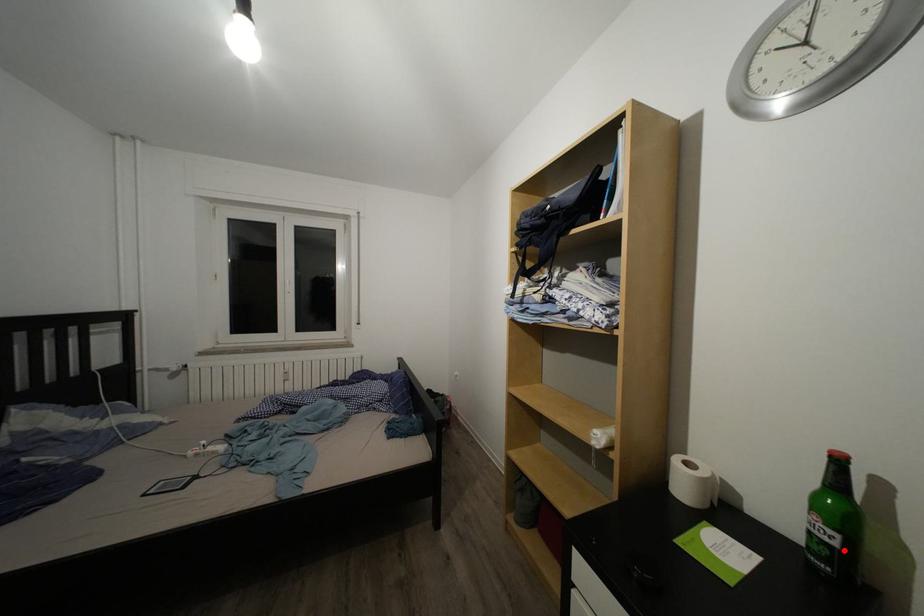
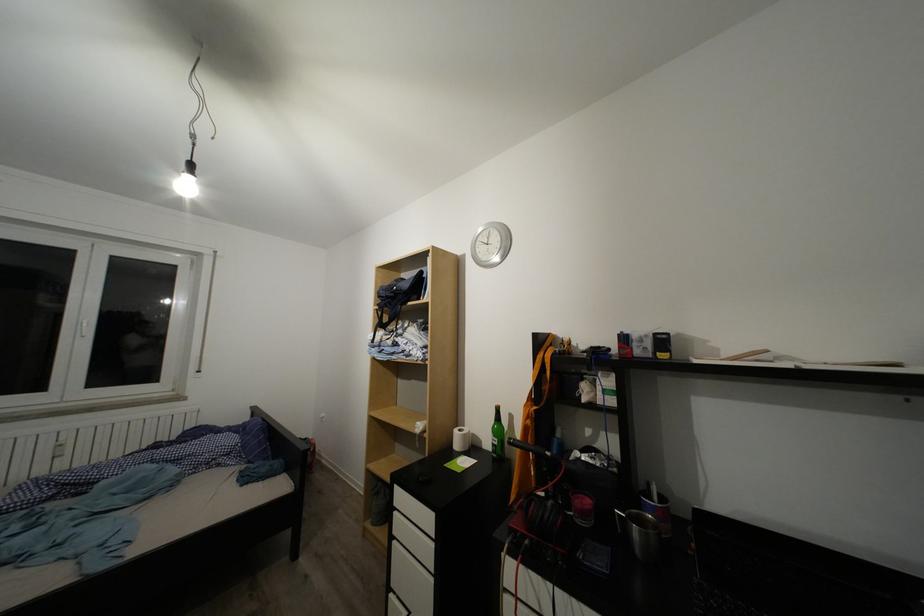
Question: I am providing you with two images of the same scene from different viewpoints. Given a red point in image1, look at the same physical point in image2. Is it:

Choices:
 (A) Closer to the viewpoint
 (B) Farther from the viewpoint

Answer: (B)